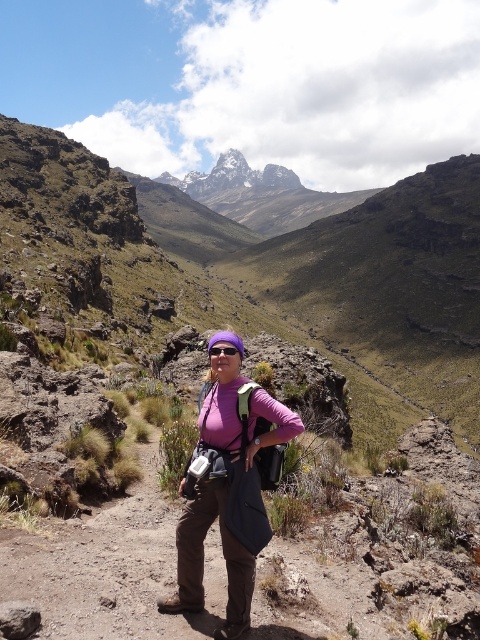
Question: From the image, what is the correct spatial relationship of pink fabric shirt at center in relation to rugged granite peak at center?

Choices:
 (A) below
 (B) above

Answer: (A)

Question: Does rugged granite peak at center appear under purple reflective goggles at center?

Choices:
 (A) no
 (B) yes

Answer: (A)

Question: Which of these objects is positioned farthest from the pink fabric shirt at center?

Choices:
 (A) rugged granite peak at center
 (B) purple reflective goggles at center

Answer: (A)

Question: In this image, where is rugged granite peak at center located relative to purple reflective goggles at center?

Choices:
 (A) left
 (B) right

Answer: (A)

Question: Which point appears farthest from the camera in this image?

Choices:
 (A) (247, 397)
 (B) (192, 195)
 (C) (207, 349)

Answer: (B)

Question: Which point is farther to the camera?

Choices:
 (A) (271, 180)
 (B) (230, 346)
 (C) (244, 426)

Answer: (A)